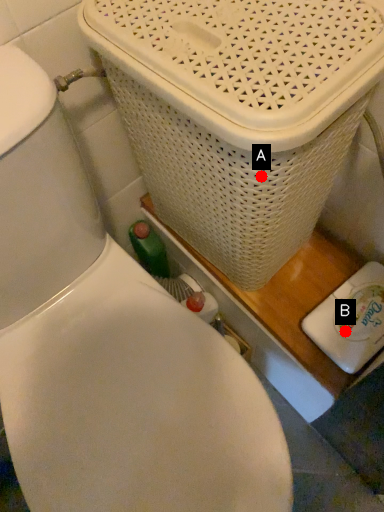
Question: Two points are circled on the image, labeled by A and B beside each circle. Which point appears closest to the camera in this image?

Choices:
 (A) A is closer
 (B) B is closer

Answer: (A)